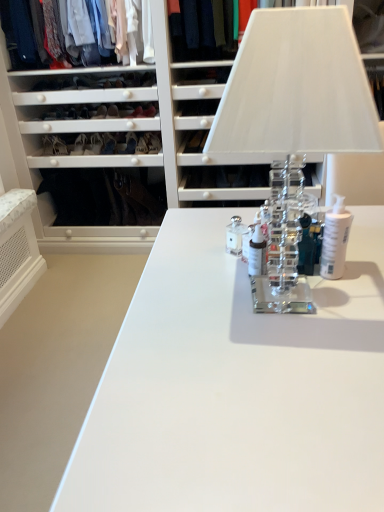
Question: Should I look upward or downward to see clear glass table lamp at center?

Choices:
 (A) up
 (B) down

Answer: (A)

Question: From a real-world perspective, is white glossy bottle at center, the second toiletry positioned from the left, located beneath matte black shoe at center, placed as the 2th shoe when sorted from left to right?

Choices:
 (A) no
 (B) yes

Answer: (A)

Question: Does white glossy bottle at center, which ranks as the second toiletry in right-to-left order, have a greater width compared to matte black shoe at center, placed as the 2th shoe when sorted from left to right?

Choices:
 (A) no
 (B) yes

Answer: (A)

Question: Is the depth of white glossy bottle at center, the second toiletry positioned from the left, greater than that of matte black shoe at center, placed as the 2th shoe when sorted from left to right?

Choices:
 (A) no
 (B) yes

Answer: (A)

Question: From a real-world perspective, is white glossy bottle at center, which ranks as the second toiletry in right-to-left order, on top of matte black shoe at center, placed as the 2th shoe when sorted from left to right?

Choices:
 (A) no
 (B) yes

Answer: (B)

Question: From the image's perspective, is white glossy bottle at center, which ranks as the second toiletry in right-to-left order, located beneath matte black shoe at center, placed as the 2th shoe when sorted from left to right?

Choices:
 (A) yes
 (B) no

Answer: (A)

Question: Is white glossy bottle at center, the second toiletry positioned from the left, in contact with matte black shoe at center, the second shoe from the right?

Choices:
 (A) yes
 (B) no

Answer: (B)

Question: From a real-world perspective, is matte black shoe at center, placed as the 2th shoe when sorted from left to right, below clear glass table lamp at center?

Choices:
 (A) yes
 (B) no

Answer: (A)

Question: Can you confirm if matte black shoe at center, placed as the 2th shoe when sorted from left to right, is wider than clear glass table lamp at center?

Choices:
 (A) no
 (B) yes

Answer: (A)

Question: Is the depth of matte black shoe at center, placed as the 2th shoe when sorted from left to right, less than that of clear glass table lamp at center?

Choices:
 (A) no
 (B) yes

Answer: (A)

Question: From the image's perspective, would you say matte black shoe at center, placed as the 2th shoe when sorted from left to right, is positioned over clear glass table lamp at center?

Choices:
 (A) no
 (B) yes

Answer: (B)

Question: From a real-world perspective, does matte black shoe at center, the second shoe from the right, stand above clear glass table lamp at center?

Choices:
 (A) no
 (B) yes

Answer: (A)

Question: Does matte black shoe at center, placed as the 2th shoe when sorted from left to right, have a smaller size compared to clear glass table lamp at center?

Choices:
 (A) yes
 (B) no

Answer: (A)

Question: Is there a large distance between matte black shoe at center, placed as the 2th shoe when sorted from left to right, and clear glass toiletry at center, arranged as the 1th toiletry when viewed from the left?

Choices:
 (A) yes
 (B) no

Answer: (A)